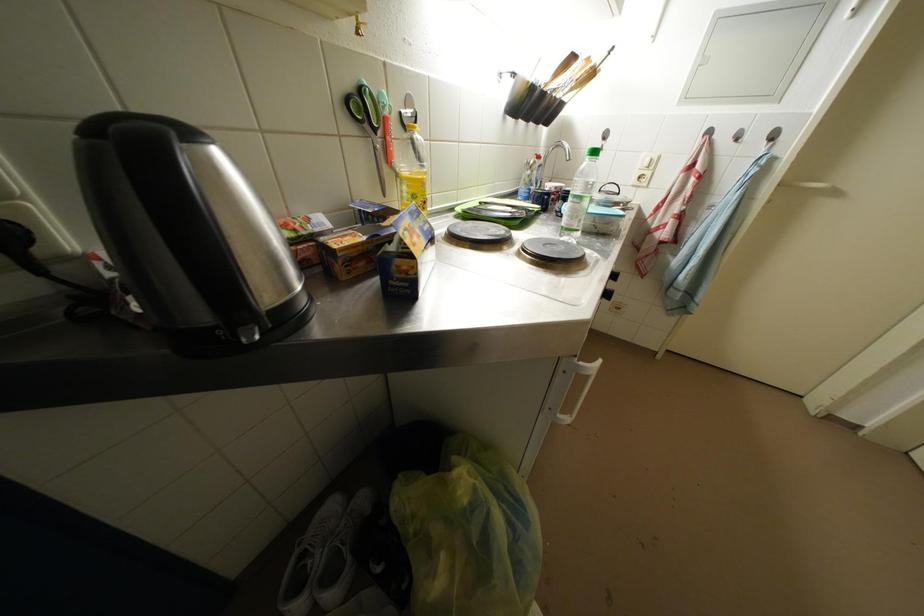
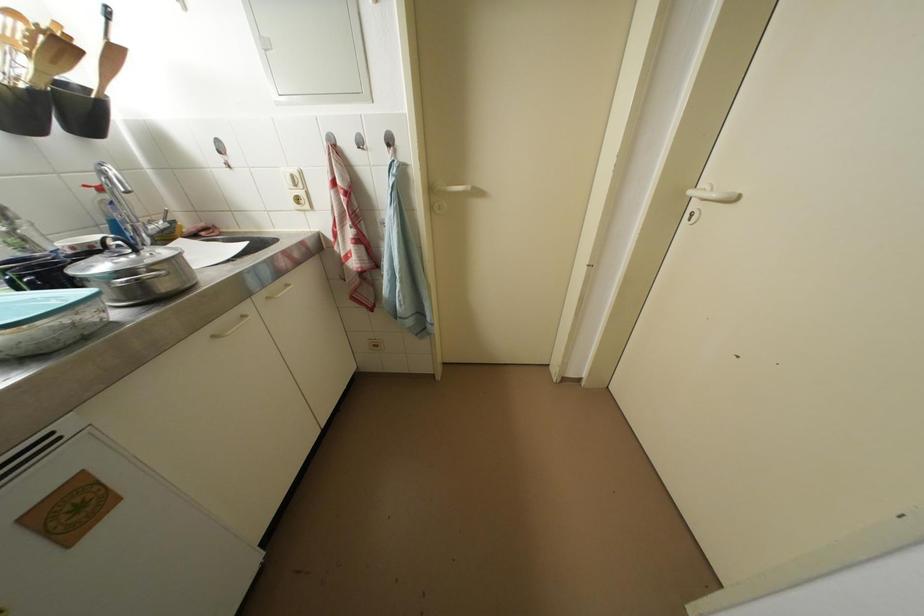
The point at (x=599, y=78) is marked in the first image. Where is the corresponding point in the second image?

(69, 50)